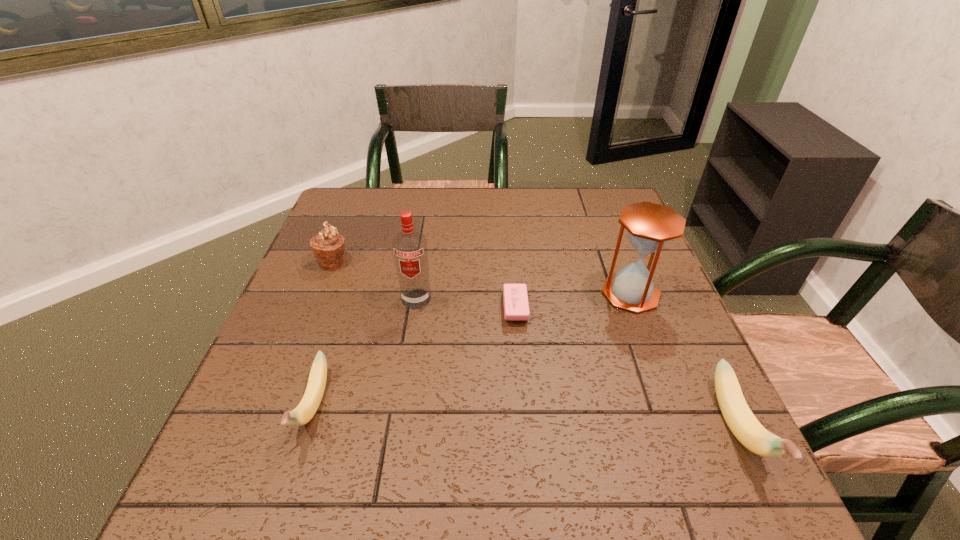
If equal spacing is the goal by inserting an additional banana among them, please point out a vacant space for this new banana. Please provide its 2D coordinates. Your answer should be formatted as a tuple, i.e. [(x, y)], where the tuple contains the x and y coordinates of a point satisfying the conditions above.

[(520, 417)]